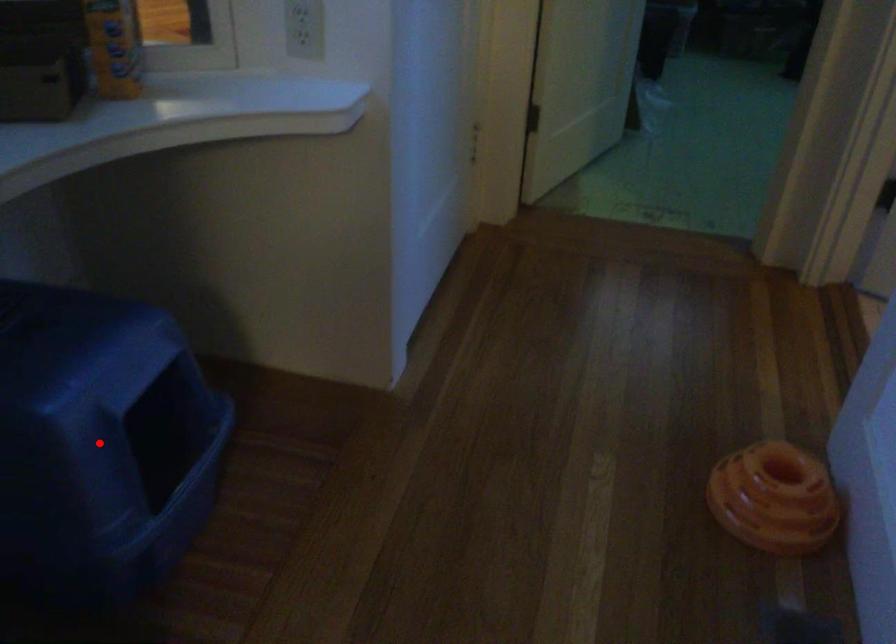
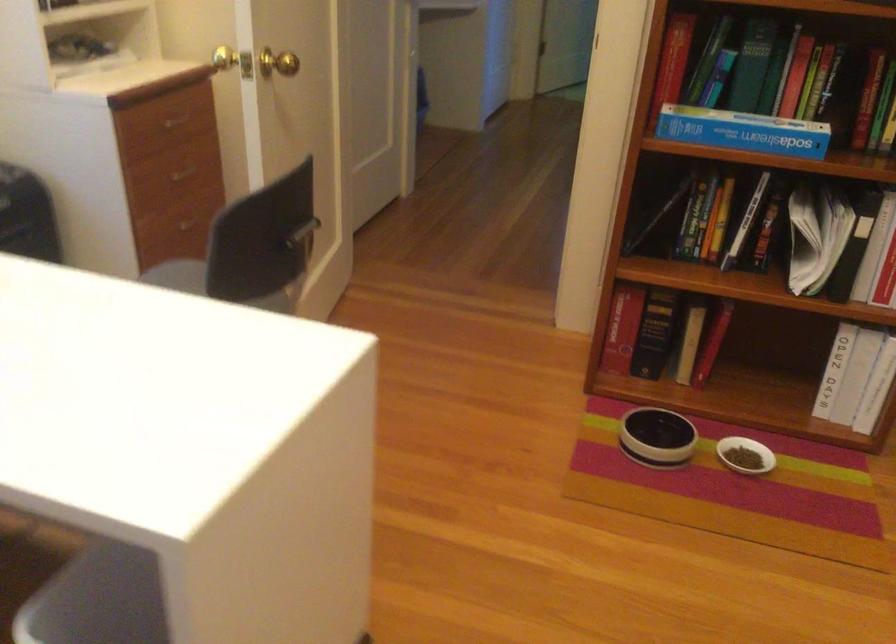
Question: I am providing you with two images of the same scene from different viewpoints. A red point is marked on the first image. Can you still see the location of the red point in image 2?

Choices:
 (A) Yes
 (B) No

Answer: (B)